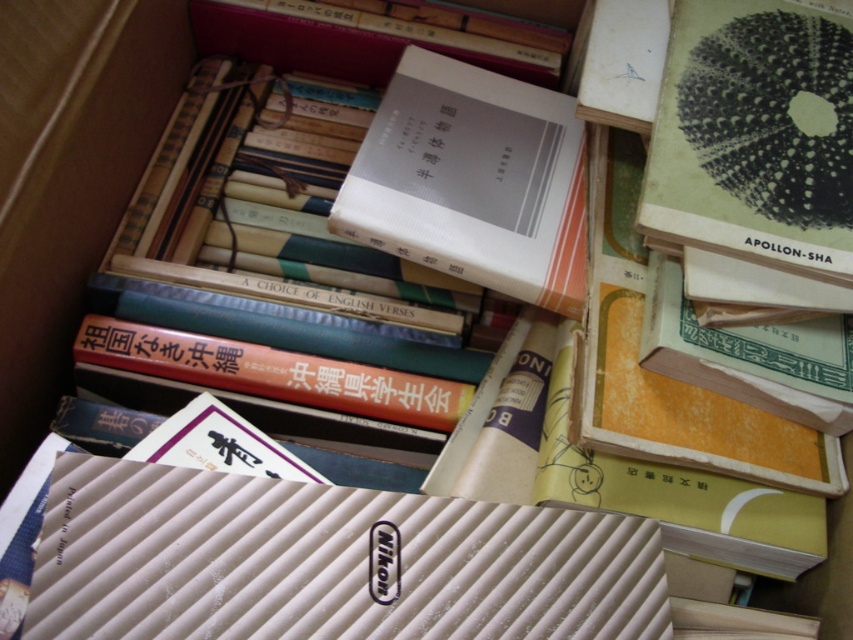
Question: Is white textured filter at lower left wider than green matte book at upper right?

Choices:
 (A) yes
 (B) no

Answer: (A)

Question: Does white textured filter at lower left come in front of green matte book at upper right?

Choices:
 (A) no
 (B) yes

Answer: (B)

Question: Which is nearer to the white textured filter at lower left?

Choices:
 (A) white matte book at center
 (B) green matte book at upper right

Answer: (A)

Question: Which point is farther from the camera taking this photo?

Choices:
 (A) click(78, 634)
 (B) click(541, 257)
 (C) click(704, 192)

Answer: (B)

Question: Where is white textured filter at lower left located in relation to green matte book at upper right in the image?

Choices:
 (A) right
 (B) left

Answer: (B)

Question: Which point is farther to the camera?

Choices:
 (A) click(x=128, y=488)
 (B) click(x=471, y=205)

Answer: (B)